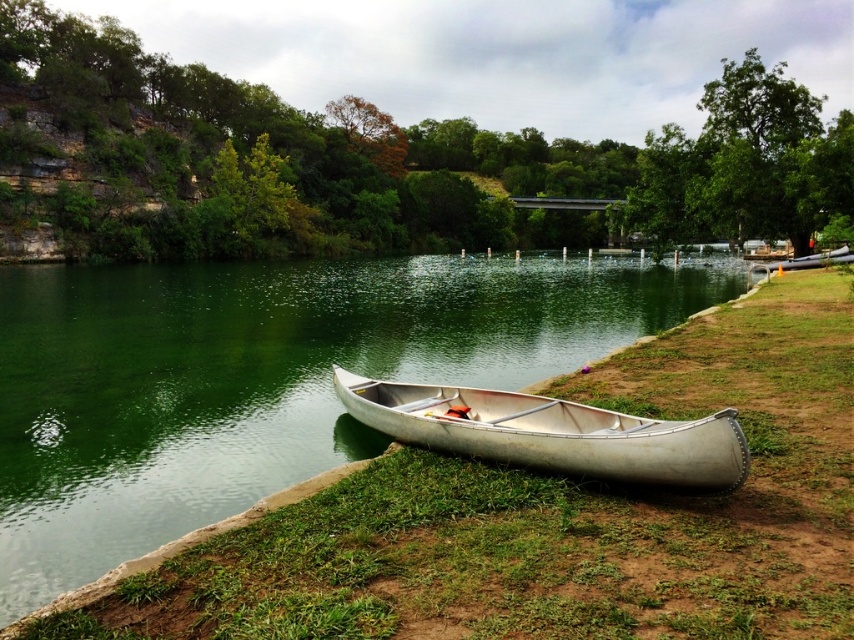
What is the location of the point with coordinates (262,378) in the image?

The point with coordinates (262,378) corresponds to the green metallic river at lower left.

You are standing at the center of the image and want to find the green metallic river at lower left. In which direction should you look to locate it?

The green metallic river at lower left is located at point [262,378], so you should look to the lower left direction to find it.

You are standing at the edge of the lake and see the green metallic river at lower left and the silver metallic canoe at lower center. Which object is positioned to the right of the other?

The green metallic river at lower left is to the right of the silver metallic canoe at lower center.